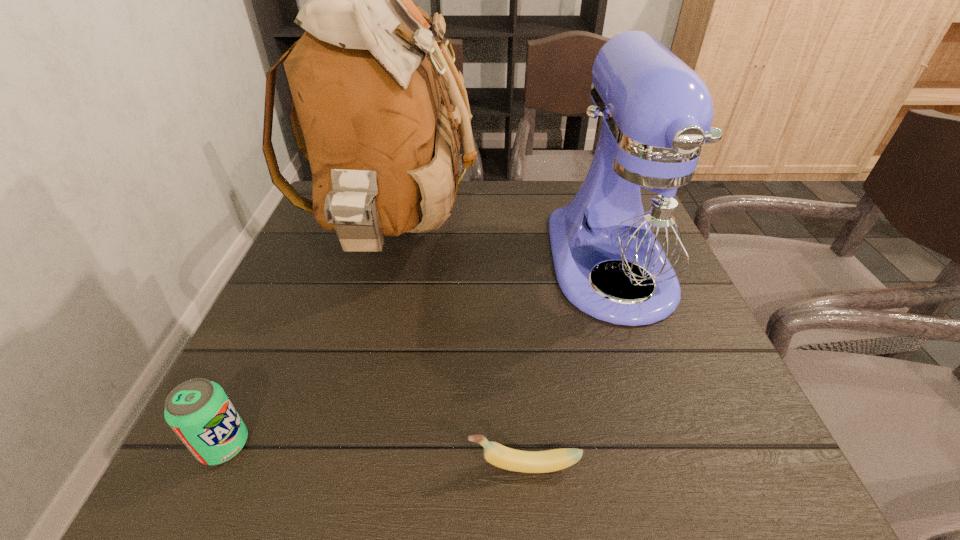
Where is `vacant space located 0.190m at the stem of the banana`? This screenshot has width=960, height=540. vacant space located 0.190m at the stem of the banana is located at coordinates [x=338, y=466].

The height and width of the screenshot is (540, 960). Find the location of `backpack that is at the far edge`. backpack that is at the far edge is located at coordinates (367, 78).

Where is `mixer present at the far edge`? Image resolution: width=960 pixels, height=540 pixels. mixer present at the far edge is located at coordinates (640, 218).

This screenshot has width=960, height=540. I want to click on pop soda that is positioned at the near edge, so click(198, 410).

Image resolution: width=960 pixels, height=540 pixels. I want to click on banana at the near edge, so click(496, 454).

Where is `backpack situated at the left edge`? The image size is (960, 540). backpack situated at the left edge is located at coordinates (367, 78).

Where is `pop soda present at the left edge`? This screenshot has height=540, width=960. pop soda present at the left edge is located at coordinates [198, 410].

Find the location of `object located in the right edge section of the desktop`. object located in the right edge section of the desktop is located at coordinates (640, 218).

Identify the location of object at the far left corner. (367, 78).

At what (x,y) coordinates should I click in order to perform the action: click on object present at the near left corner. Please return your answer as a coordinate pair (x, y). Looking at the image, I should click on pos(198,410).